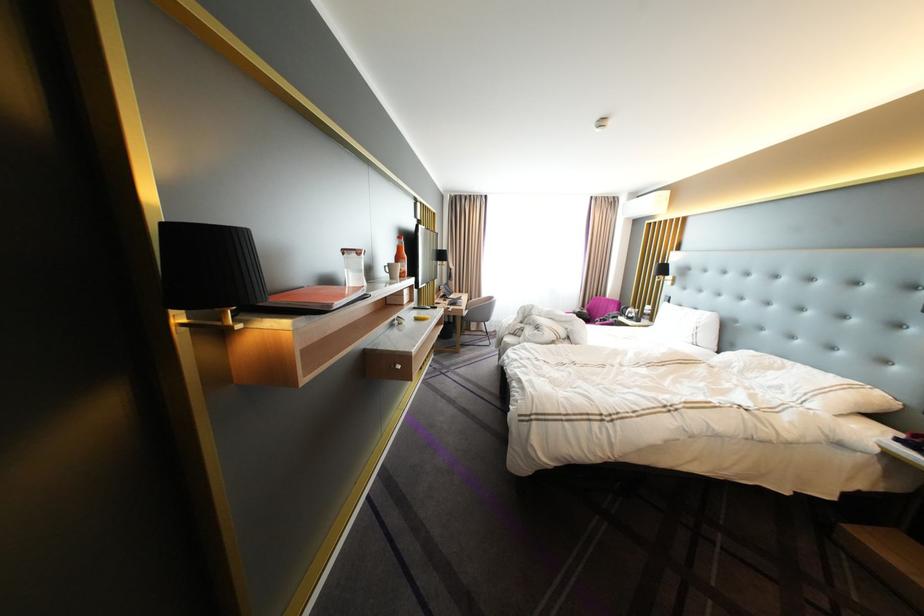
The width and height of the screenshot is (924, 616). What are the coordinates of `fuchsia chair sitting surface` in the screenshot? It's located at pos(618,312).